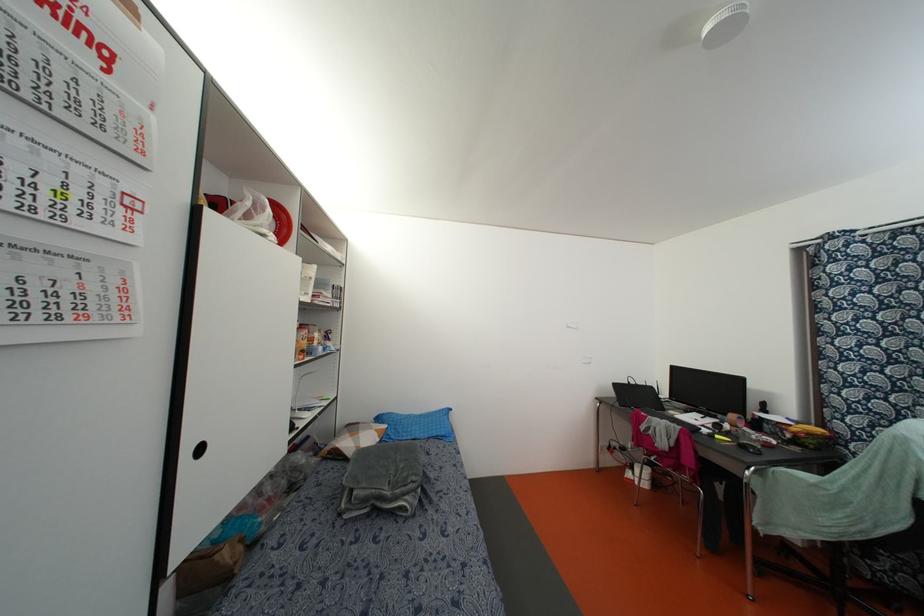
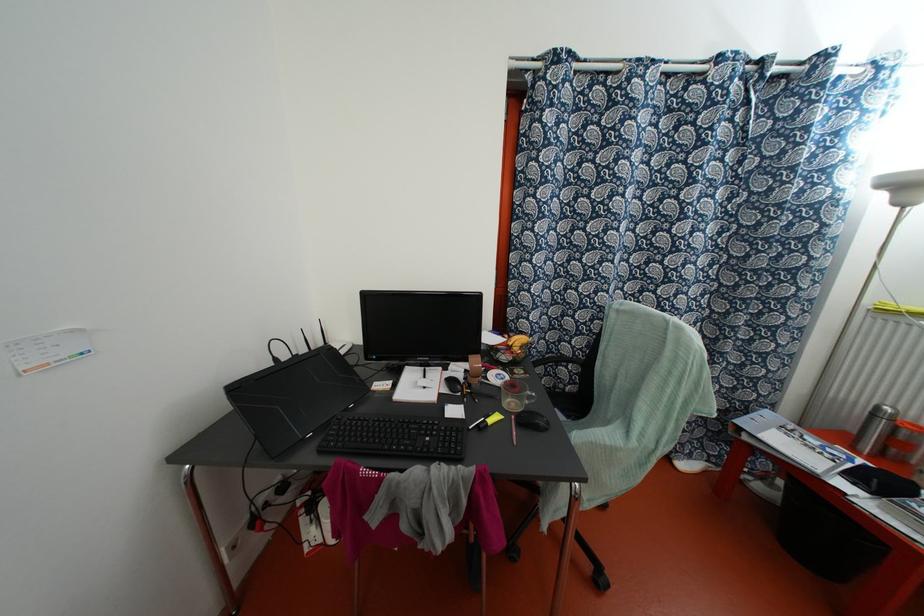
The point at [716,436] is marked in the first image. Where is the corresponding point in the second image?

(489, 421)